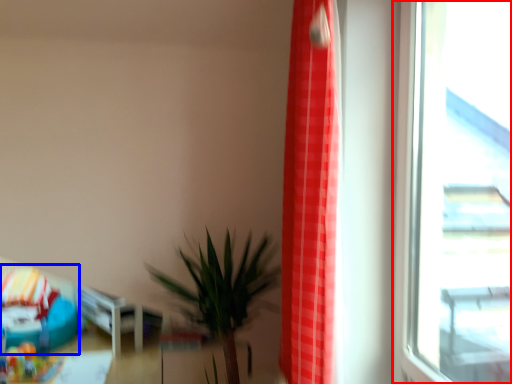
Question: Which object appears closest to the camera in this image, window (highlighted by a red box) or bean bag chair (highlighted by a blue box)?

Choices:
 (A) window
 (B) bean bag chair

Answer: (A)